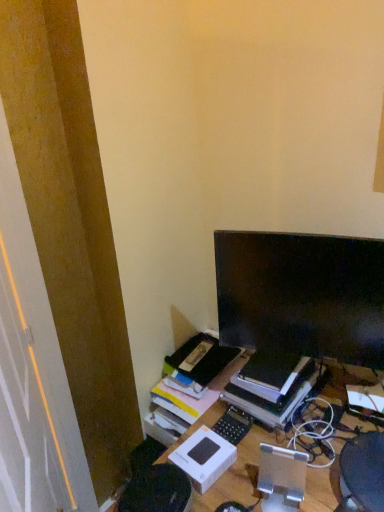
Question: In terms of width, does matte black monitor at upper right look wider or thinner when compared to black matte keyboard at center?

Choices:
 (A) wide
 (B) thin

Answer: (B)

Question: Do you think matte black monitor at upper right is within black matte keyboard at center, or outside of it?

Choices:
 (A) outside
 (B) inside

Answer: (A)

Question: Estimate the real-world distances between objects in this image. Which object is closer to the black matte keyboard at center?

Choices:
 (A) hardcover book at center
 (B) white matte cardboard box at center
 (C) matte black monitor at upper right

Answer: (B)

Question: Considering the real-world distances, which object is farthest from the hardcover book at center?

Choices:
 (A) white matte cardboard box at center
 (B) matte black monitor at upper right
 (C) black matte keyboard at center

Answer: (B)